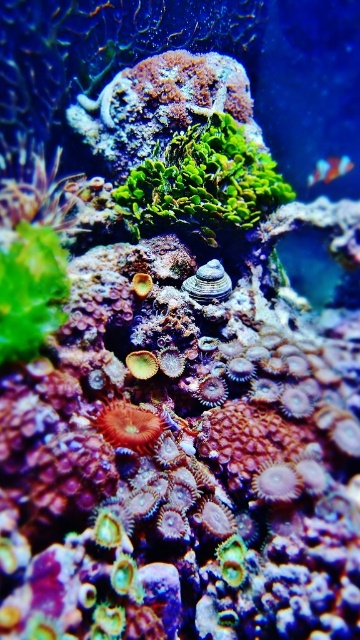
You are a scuba diver swimming in this underwater scene. You notice the green matte algae at center and the red coral at center. Which object is closer to you as you look straight ahead?

The green matte algae at center is closer to you because the red coral at center is behind it.

You are a marine biologist observing an underwater scene. You notice the green matte algae at center and the green leafy plant at left. Which one is located to the right of the other?

The green matte algae at center is positioned on the right side of the green leafy plant at left.